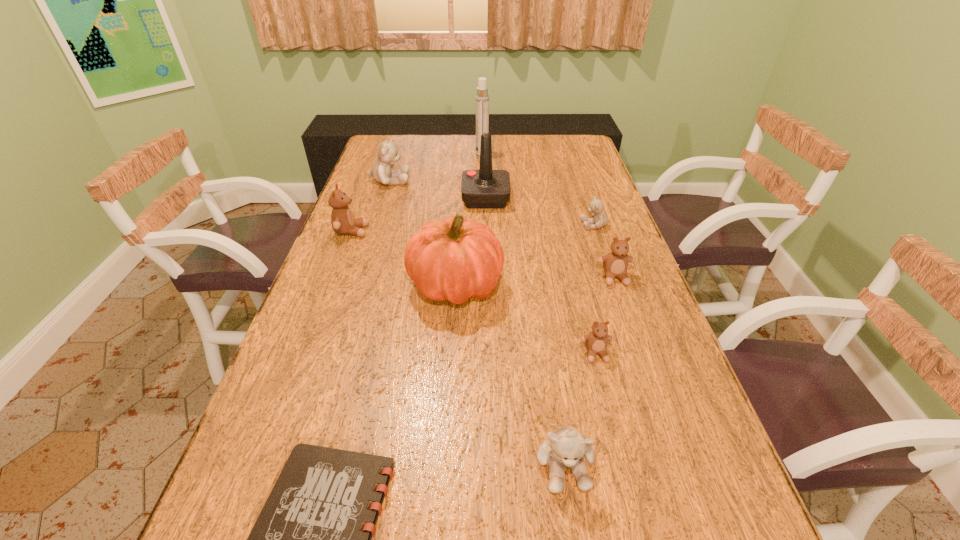
Locate an element on the screen. This screenshot has height=540, width=960. free space at the far left corner of the desktop is located at coordinates (403, 148).

Where is `free spot between the tallest object and the smallest gray teddy bear`? Image resolution: width=960 pixels, height=540 pixels. free spot between the tallest object and the smallest gray teddy bear is located at coordinates (539, 191).

Locate an element on the screen. The image size is (960, 540). empty space between the second farthest brown teddy bear and the rightmost gray teddy bear is located at coordinates (605, 251).

Find the location of `empty location between the farthest object and the seventh object from left to right`. empty location between the farthest object and the seventh object from left to right is located at coordinates pos(523,310).

Find the location of `free space between the farthest object and the leftmost gray teddy bear`. free space between the farthest object and the leftmost gray teddy bear is located at coordinates (436, 168).

What are the coordinates of `free space between the biggest brown teddy bear and the orange pumpkin` in the screenshot? It's located at (404, 258).

The width and height of the screenshot is (960, 540). What are the coordinates of `vacant space that's between the pumpkin and the third object from right to left` in the screenshot? It's located at point(526,319).

The image size is (960, 540). Find the location of `free space between the leftmost gray teddy bear and the farthest brown teddy bear`. free space between the leftmost gray teddy bear and the farthest brown teddy bear is located at coordinates (371, 206).

This screenshot has height=540, width=960. I want to click on free space that is in between the pumpkin and the second gray teddy bear from right to left, so click(510, 374).

Locate an element on the screen. The image size is (960, 540). object that is the seventh closest to the leftmost gray teddy bear is located at coordinates (596, 341).